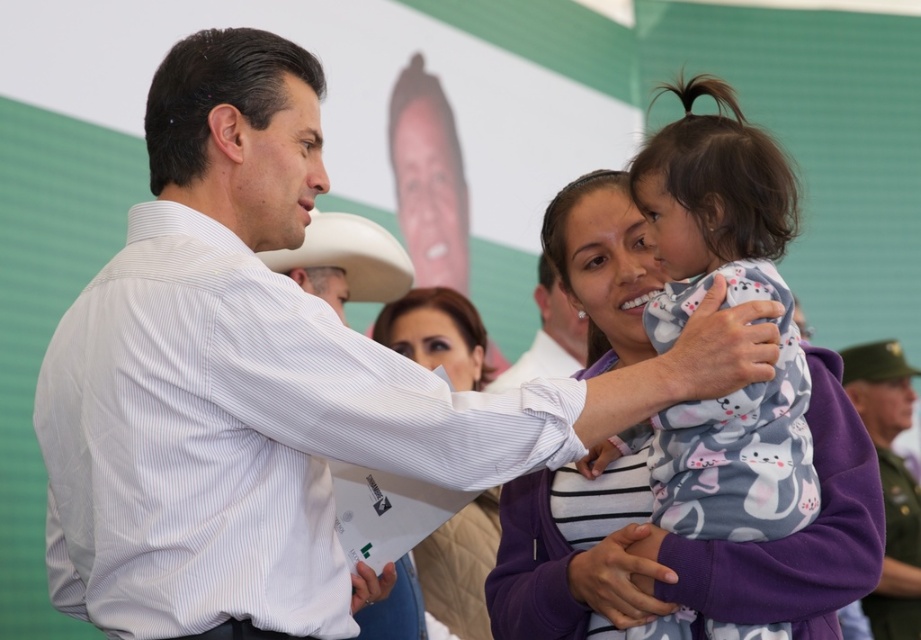
Based on the photo, you are standing at the origin point in the image. Which direction should you move to reach the purple fleece jacket at center?

To reach the purple fleece jacket at center, you should move towards the point with coordinates 0.755 on the x axis and 0.966 on the y axis.

You are a photographer at the event and want to capture a photo that includes both the printed cotton onesie at center and the purple fleece jacket at center. The camera can only focus on objects within a 3 meter range. Will both items be in focus?

The printed cotton onesie at center is 3.50 meters away from purple fleece jacket at center. Since the distance between them exceeds the camera focus range of 3 meters, the camera cannot focus on both items simultaneously.